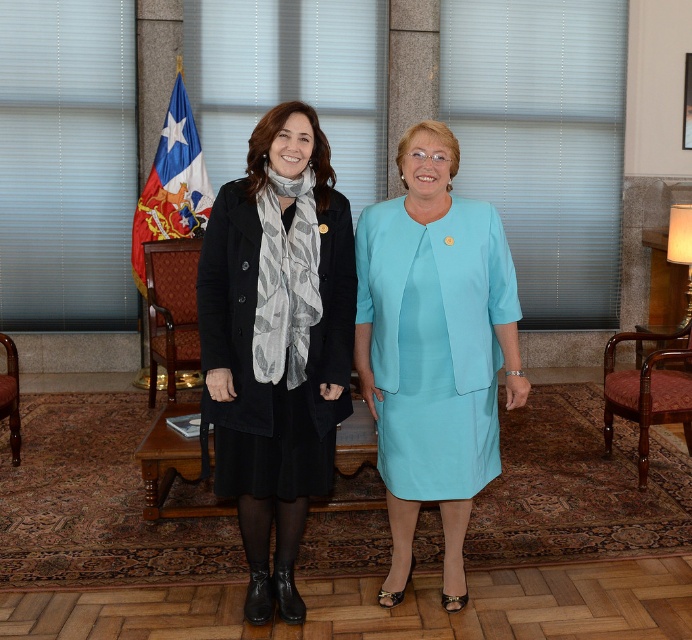
Question: Which point is farther to the camera?

Choices:
 (A) blue fabric flag at left
 (B) wooden armchair at left
 (C) light blue fabric dress at center

Answer: (A)

Question: Which is farther from the mahogany wood armchair at lower right?

Choices:
 (A) light blue fabric dress at center
 (B) blue fabric flag at left

Answer: (B)

Question: Does blue fabric flag at left appear over wooden armchair at left?

Choices:
 (A) no
 (B) yes

Answer: (B)

Question: Where is blue fabric flag at left located in relation to wooden armchair at left in the image?

Choices:
 (A) above
 (B) below

Answer: (A)

Question: Which is farther from the black matte coat at center?

Choices:
 (A) wooden armchair at left
 (B) blue fabric flag at left

Answer: (B)

Question: Considering the relative positions of light blue fabric dress at center and mahogany wood armchair at lower right in the image provided, where is light blue fabric dress at center located with respect to mahogany wood armchair at lower right?

Choices:
 (A) right
 (B) left

Answer: (B)